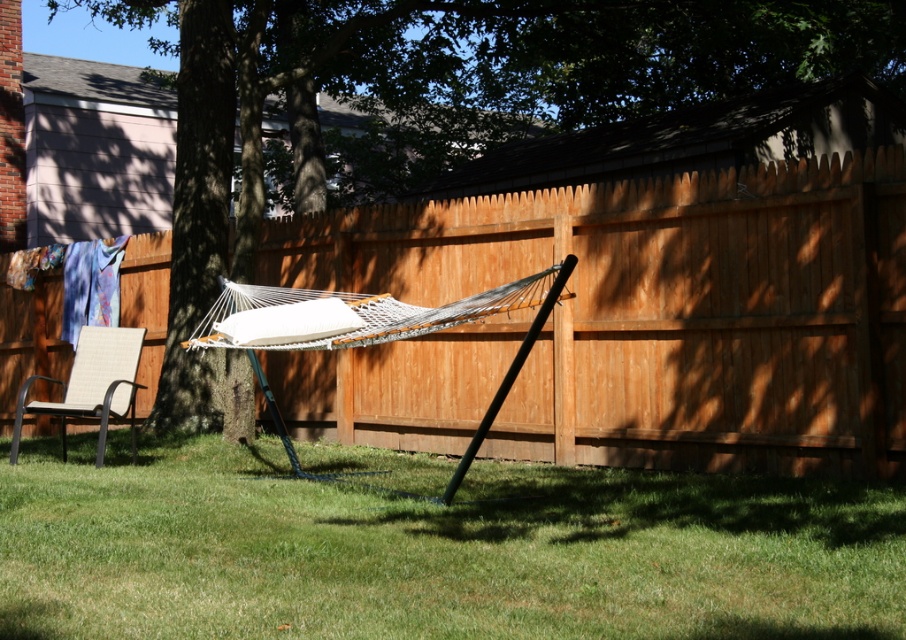
Question: Does green grass at center have a greater width compared to beige woven chair at lower left?

Choices:
 (A) yes
 (B) no

Answer: (B)

Question: Considering the real-world distances, which object is closest to the beige woven chair at lower left?

Choices:
 (A) brown wood tree at center
 (B) green grass at center

Answer: (B)

Question: Is green grass at center positioned in front of brown wood tree at center?

Choices:
 (A) yes
 (B) no

Answer: (A)

Question: Which object is positioned closest to the beige woven chair at lower left?

Choices:
 (A) green grass at center
 (B) brown wood tree at center

Answer: (A)

Question: Which object is the farthest from the green grass at center?

Choices:
 (A) beige woven chair at lower left
 (B) brown wood tree at center

Answer: (B)

Question: Does green grass at center have a greater width compared to brown wood tree at center?

Choices:
 (A) no
 (B) yes

Answer: (A)